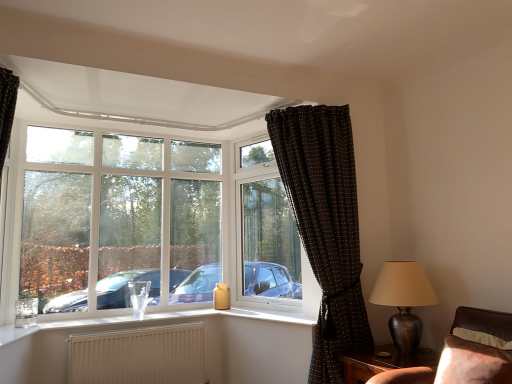
Question: Choose the correct answer: Is white plastic window at upper left inside white plastic vase at lower center or outside it?

Choices:
 (A) outside
 (B) inside

Answer: (A)

Question: From the image's perspective, is white plastic window at upper left located above or below white plastic vase at lower center?

Choices:
 (A) below
 (B) above

Answer: (B)

Question: Which of these objects is positioned closest to the brown dotted fabric curtain at upper right, which is the second curtain from left to right?

Choices:
 (A) black dotted fabric curtain at left, placed as the first curtain when sorted from left to right
 (B) white textured radiator at lower center
 (C) metallic bronze table lamp at right
 (D) brown wooden table at lower right
 (E) white plastic vase at lower center

Answer: (C)

Question: Which is nearer to the brown leather couch at lower right?

Choices:
 (A) brown dotted fabric curtain at upper right, which is the 1th curtain from right to left
 (B) black dotted fabric curtain at left, placed as the first curtain when sorted from left to right
 (C) metallic bronze table lamp at right
 (D) white plastic vase at lower center
 (E) white plastic window at center

Answer: (C)